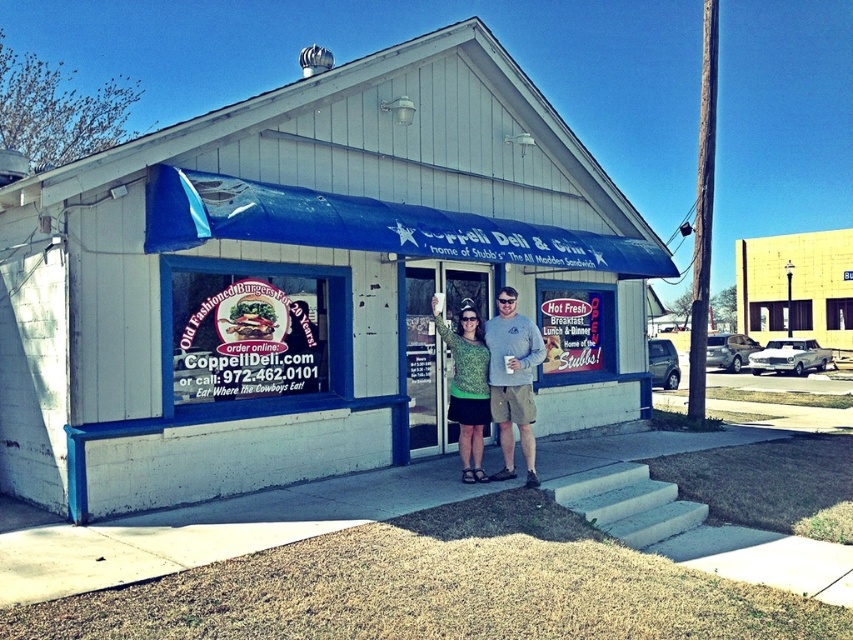
Question: Is white wood building at center positioned behind green knit sweater at center?

Choices:
 (A) no
 (B) yes

Answer: (A)

Question: Does blue fabric awning at center come behind green knit sweater at center?

Choices:
 (A) yes
 (B) no

Answer: (B)

Question: Observing the image, what is the correct spatial positioning of green knit sweater at center in reference to green textured sweater at center?

Choices:
 (A) left
 (B) right

Answer: (B)

Question: Among these objects, which one is farthest from the camera?

Choices:
 (A) white wood building at center
 (B) green textured sweater at center

Answer: (B)

Question: Which point is farther from the camera taking this photo?

Choices:
 (A) [x=402, y=397]
 (B) [x=437, y=314]
 (C) [x=265, y=200]

Answer: (A)

Question: Among these objects, which one is farthest from the camera?

Choices:
 (A) white wood building at center
 (B) blue fabric awning at center
 (C) green textured sweater at center
 (D) green knit sweater at center

Answer: (C)